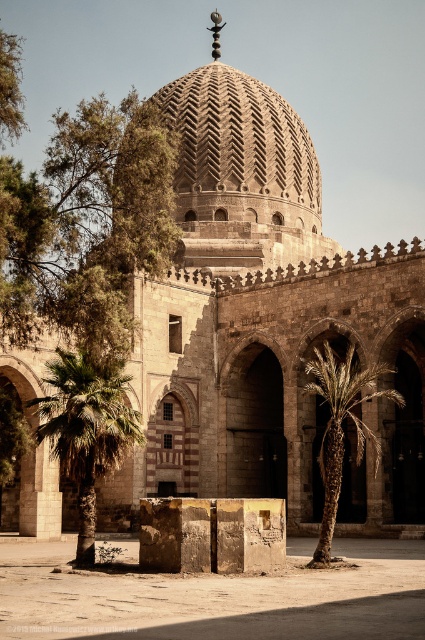
Question: Can you confirm if green leafy palm at lower left is smaller than green leafy palm tree at center?

Choices:
 (A) yes
 (B) no

Answer: (A)

Question: Which of these objects is positioned closest to the stone textured dome at center?

Choices:
 (A) green leafy palm at lower left
 (B) stone pillar at center
 (C) green leafy palm tree at center

Answer: (C)

Question: Can you confirm if stone pillar at center is positioned above stone textured dome at center?

Choices:
 (A) no
 (B) yes

Answer: (A)

Question: Which object appears farthest from the camera in this image?

Choices:
 (A) green leafy palm at lower left
 (B) stone pillar at center
 (C) stone textured dome at center

Answer: (C)

Question: From the image, what is the correct spatial relationship of stone textured dome at center in relation to green leafy palm at lower left?

Choices:
 (A) above
 (B) below

Answer: (A)

Question: Which point is farther from the camera taking this photo?

Choices:
 (A) (173, 81)
 (B) (363, 445)
 (C) (129, 420)
 (D) (166, 580)

Answer: (A)